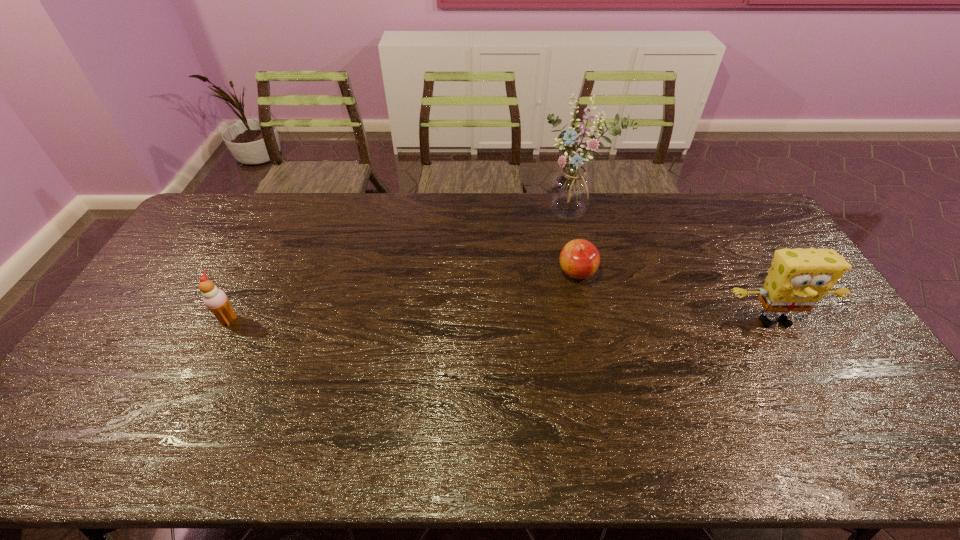
Image resolution: width=960 pixels, height=540 pixels. In the image, there is a desktop. Identify the location of vacant space at the right edge. (824, 326).

You are a GUI agent. You are given a task and a screenshot of the screen. Output one action in this format:
    pyautogui.click(x=<x>, y=<y>)
    Task: Click on the free region at the far left corner of the desktop
    The height and width of the screenshot is (540, 960).
    Given the screenshot: What is the action you would take?
    pyautogui.click(x=239, y=194)

This screenshot has width=960, height=540. What are the coordinates of `blank area at the far right corner` in the screenshot? It's located at (754, 210).

Image resolution: width=960 pixels, height=540 pixels. I want to click on free space between the second farthest object and the icecream, so click(x=402, y=296).

Where is `free point between the third shortest object and the icecream`? The width and height of the screenshot is (960, 540). free point between the third shortest object and the icecream is located at coordinates (501, 320).

What are the coordinates of `free area in between the icecream and the tallest object` in the screenshot? It's located at (401, 266).

Locate an element on the screen. vacant region between the bouquet and the third shortest object is located at coordinates (674, 267).

Image resolution: width=960 pixels, height=540 pixels. Find the location of `empty space that is in between the apple and the icecream`. empty space that is in between the apple and the icecream is located at coordinates (402, 296).

Locate an element on the screen. The image size is (960, 540). free space between the second tallest object and the icecream is located at coordinates (501, 320).

The image size is (960, 540). In order to click on blank region between the third tallest object and the second tallest object in this screenshot , I will do `click(501, 320)`.